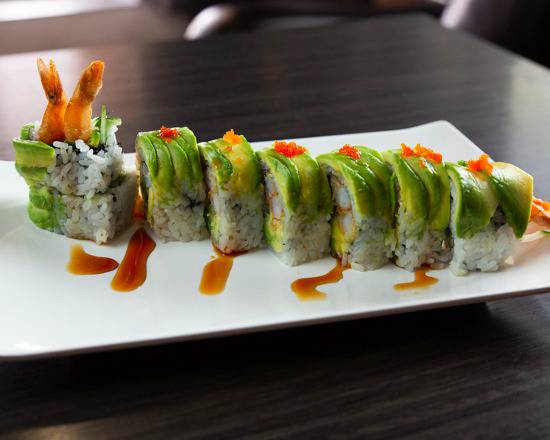
Image resolution: width=550 pixels, height=440 pixels. What are the coordinates of `table` in the screenshot? It's located at (402, 68).